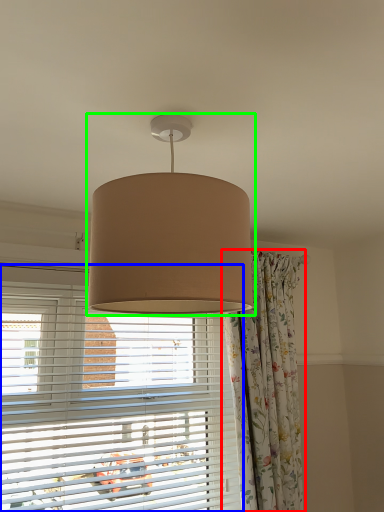
Question: Estimate the real-world distances between objects in this image. Which object is farther from curtain (highlighted by a red box), window blind (highlighted by a blue box) or lamp (highlighted by a green box)?

Choices:
 (A) window blind
 (B) lamp

Answer: (B)